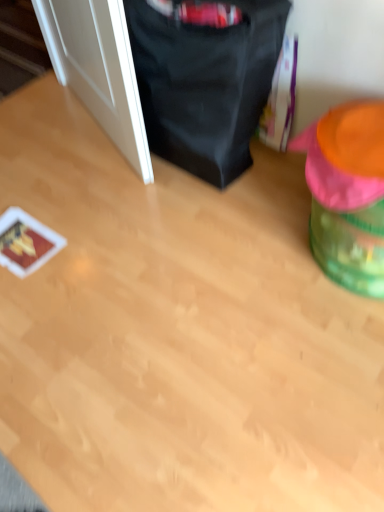
Question: Which direction should I rotate to look at black fabric bean bag chair at upper center, placed as the 1th bean bag chair when sorted from left to right, — up or down?

Choices:
 (A) up
 (B) down

Answer: (A)

Question: From a real-world perspective, is white glossy door at left positioned over green plastic bean bag chair at right, the 2th bean bag chair viewed from the left, based on gravity?

Choices:
 (A) yes
 (B) no

Answer: (A)

Question: Is white glossy door at left positioned before green plastic bean bag chair at right, the 2th bean bag chair viewed from the left?

Choices:
 (A) yes
 (B) no

Answer: (B)

Question: From the image's perspective, is white glossy door at left on green plastic bean bag chair at right, which is counted as the first bean bag chair, starting from the right?

Choices:
 (A) no
 (B) yes

Answer: (B)

Question: From the image's perspective, is white glossy door at left located beneath green plastic bean bag chair at right, the 2th bean bag chair viewed from the left?

Choices:
 (A) yes
 (B) no

Answer: (B)

Question: Is white glossy door at left shorter than green plastic bean bag chair at right, the 2th bean bag chair viewed from the left?

Choices:
 (A) yes
 (B) no

Answer: (B)

Question: Is white glossy door at left surrounding green plastic bean bag chair at right, the 2th bean bag chair viewed from the left?

Choices:
 (A) no
 (B) yes

Answer: (A)

Question: Is white glossy door at left further to the viewer compared to black fabric bean bag chair at upper center, placed as the 1th bean bag chair when sorted from left to right?

Choices:
 (A) no
 (B) yes

Answer: (B)

Question: Is white glossy door at left with black fabric bean bag chair at upper center, the second bean bag chair from the right?

Choices:
 (A) yes
 (B) no

Answer: (B)

Question: Is white glossy door at left bigger than black fabric bean bag chair at upper center, placed as the 1th bean bag chair when sorted from left to right?

Choices:
 (A) yes
 (B) no

Answer: (B)

Question: Is white glossy door at left taller than black fabric bean bag chair at upper center, the second bean bag chair from the right?

Choices:
 (A) no
 (B) yes

Answer: (B)

Question: Does white glossy door at left have a smaller size compared to black fabric bean bag chair at upper center, placed as the 1th bean bag chair when sorted from left to right?

Choices:
 (A) no
 (B) yes

Answer: (B)

Question: Could you tell me if white glossy door at left is facing black fabric bean bag chair at upper center, the second bean bag chair from the right?

Choices:
 (A) no
 (B) yes

Answer: (A)

Question: From a real-world perspective, is green plastic bean bag chair at right, the 2th bean bag chair viewed from the left, over white glossy door at left?

Choices:
 (A) yes
 (B) no

Answer: (B)